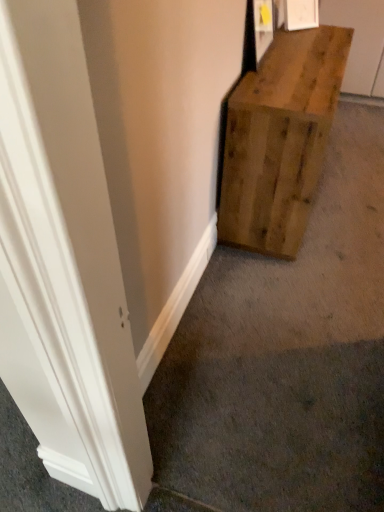
Where is `natural wood bench at right`? This screenshot has width=384, height=512. natural wood bench at right is located at coordinates (280, 140).

What do you see at coordinates (280, 140) in the screenshot? I see `natural wood bench at right` at bounding box center [280, 140].

What do you see at coordinates (286, 357) in the screenshot? The width and height of the screenshot is (384, 512). I see `natural wood crate at center-right` at bounding box center [286, 357].

Find the location of a particular element. natural wood crate at center-right is located at coordinates (286, 357).

Locate an element on the screen. natural wood bench at right is located at coordinates (280, 140).

Which object is positioned more to the left, natural wood crate at center-right or natural wood bench at right?

Positioned to the left is natural wood crate at center-right.

Which is behind, natural wood crate at center-right or natural wood bench at right?

Positioned behind is natural wood bench at right.

Does point (241, 302) lie in front of point (266, 149)?

No, it is behind (266, 149).

From the image's perspective, which one is positioned higher, natural wood crate at center-right or natural wood bench at right?

natural wood bench at right.

In the scene shown: From a real-world perspective, which is physically below, natural wood crate at center-right or natural wood bench at right?

From a 3D spatial view, natural wood bench at right is below.

Considering the sizes of natural wood crate at center-right and natural wood bench at right in the image, is natural wood crate at center-right wider or thinner than natural wood bench at right?

Clearly, natural wood crate at center-right has less width compared to natural wood bench at right.

Is natural wood crate at center-right shorter than natural wood bench at right?

Incorrect, the height of natural wood crate at center-right does not fall short of that of natural wood bench at right.

Based on their sizes in the image, would you say natural wood crate at center-right is bigger or smaller than natural wood bench at right?

natural wood crate at center-right is smaller than natural wood bench at right.

From the picture: Is natural wood bench at right located within natural wood crate at center-right?

No, natural wood bench at right is not surrounded by natural wood crate at center-right.

Is there a large distance between natural wood crate at center-right and natural wood bench at right?

Actually, natural wood crate at center-right and natural wood bench at right are a little close together.

Does natural wood crate at center-right turn towards natural wood bench at right?

Yes, natural wood crate at center-right is facing natural wood bench at right.

What's the angular difference between natural wood crate at center-right and natural wood bench at right's facing directions?

The angular difference between natural wood crate at center-right and natural wood bench at right is 89.9 degrees.

Where is `furniture on the right of natural wood crate at center-right`? The image size is (384, 512). furniture on the right of natural wood crate at center-right is located at coordinates (280, 140).

Which object is positioned more to the left, natural wood bench at right or natural wood crate at center-right?

natural wood crate at center-right is more to the left.

Who is more distant, natural wood bench at right or natural wood crate at center-right?

Positioned behind is natural wood bench at right.

Does point (280, 156) appear closer or farther from the camera than point (345, 169)?

Clearly, point (280, 156) is closer to the camera than point (345, 169).

From the image's perspective, is natural wood bench at right located beneath natural wood crate at center-right?

Incorrect, from the image's perspective, natural wood bench at right is higher than natural wood crate at center-right.

From a real-world perspective, is natural wood bench at right physically located above or below natural wood crate at center-right?

In terms of real-world spatial position, natural wood bench at right is below natural wood crate at center-right.

Looking at their sizes, would you say natural wood bench at right is wider or thinner than natural wood crate at center-right?

natural wood bench at right is wider than natural wood crate at center-right.

Considering the sizes of objects natural wood bench at right and natural wood crate at center-right in the image provided, who is shorter, natural wood bench at right or natural wood crate at center-right?

With less height is natural wood bench at right.

Considering the sizes of objects natural wood bench at right and natural wood crate at center-right in the image provided, who is bigger, natural wood bench at right or natural wood crate at center-right?

With larger size is natural wood bench at right.

Is natural wood bench at right completely or partially outside of natural wood crate at center-right?

Yes, natural wood bench at right is located beyond the bounds of natural wood crate at center-right.

Is natural wood bench at right far away from natural wood crate at center-right?

No, natural wood bench at right is not far from natural wood crate at center-right.

Is natural wood crate at center-right at the back of natural wood bench at right?

natural wood bench at right is not turned away from natural wood crate at center-right.

What's the angular difference between natural wood bench at right and natural wood crate at center-right's facing directions?

89.9 degrees separate the facing orientations of natural wood bench at right and natural wood crate at center-right.

Measure the distance between natural wood bench at right and natural wood crate at center-right.

natural wood bench at right and natural wood crate at center-right are 55.72 centimeters apart from each other.

Identify the location of concrete lying below the natural wood bench at right (from the image's perspective). Image resolution: width=384 pixels, height=512 pixels. (286, 357).

Image resolution: width=384 pixels, height=512 pixels. What are the coordinates of `concrete to the left of natural wood bench at right` in the screenshot? It's located at (286, 357).

You are a GUI agent. You are given a task and a screenshot of the screen. Output one action in this format:
    pyautogui.click(x=<x>, y=<y>)
    Task: Click on the concrete in front of the natural wood bench at right
    The width and height of the screenshot is (384, 512).
    Given the screenshot: What is the action you would take?
    pyautogui.click(x=286, y=357)